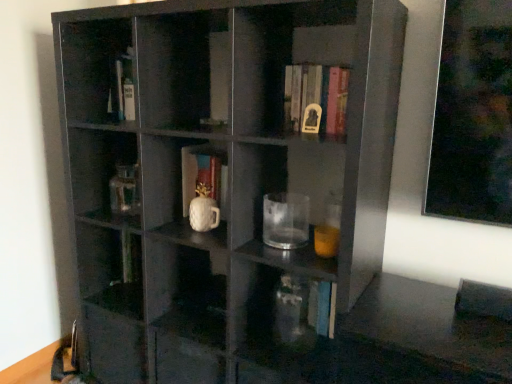
Question: From the image's perspective, is transparent glass mug at center positioned above or below hardcover book at upper center, placed as the first book when sorted from front to back?

Choices:
 (A) above
 (B) below

Answer: (B)

Question: Based on their sizes in the image, would you say transparent glass mug at center is bigger or smaller than hardcover book at upper center, which is the first book from right to left?

Choices:
 (A) big
 (B) small

Answer: (B)

Question: Based on their relative distances, which object is nearer to the transparent glass vase at lower center?

Choices:
 (A) white glossy mug at center, the 1th book in the bottom-to-top sequence
 (B) hardcover book at upper center, which ranks as the first book in top-to-bottom order
 (C) transparent glass mug at center
 (D) matte black shelf at center

Answer: (C)

Question: Based on their relative distances, which object is farther from the white glossy mug at center, which is the second book in front-to-back order?

Choices:
 (A) matte black shelf at center
 (B) hardcover book at upper center, which ranks as the 2th book in back-to-front order
 (C) transparent glass vase at lower center
 (D) transparent glass mug at center

Answer: (C)